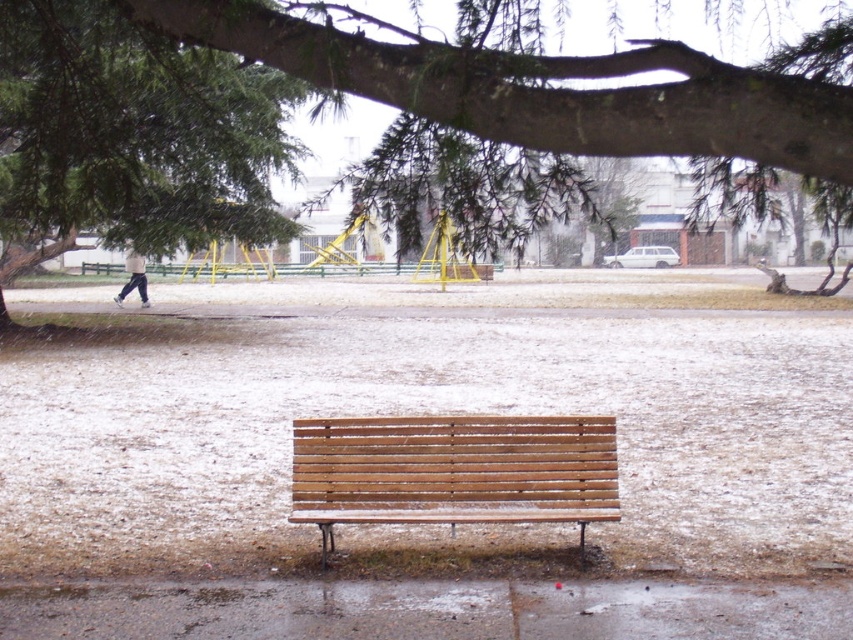
Does green textured branch at upper center have a lesser width compared to white cotton pants at left?

No, green textured branch at upper center is not thinner than white cotton pants at left.

Does green textured branch at upper center appear on the left side of white cotton pants at left?

In fact, green textured branch at upper center is to the right of white cotton pants at left.

At what (x,y) coordinates should I click in order to perform the action: click on green textured branch at upper center. Please return your answer as a coordinate pair (x, y). Looking at the image, I should click on [x=337, y=90].

Where is `green textured branch at upper center`? green textured branch at upper center is located at coordinates (337, 90).

Does green textured branch at upper center come behind light brown wooden bench at center?

No, green textured branch at upper center is in front of light brown wooden bench at center.

Between point (294, 68) and point (326, 468), which one is positioned in front?

Point (294, 68)

Where is `green textured branch at upper center`? The width and height of the screenshot is (853, 640). green textured branch at upper center is located at coordinates (337, 90).

Looking at this image, does light brown wooden bench at center have a greater height compared to white cotton pants at left?

No, light brown wooden bench at center is not taller than white cotton pants at left.

Between light brown wooden bench at center and white cotton pants at left, which one is positioned lower?

Positioned lower is light brown wooden bench at center.

Who is more forward, (485, 417) or (144, 273)?

Point (485, 417) is in front.

Find the location of a particular element. This screenshot has height=640, width=853. light brown wooden bench at center is located at coordinates (453, 472).